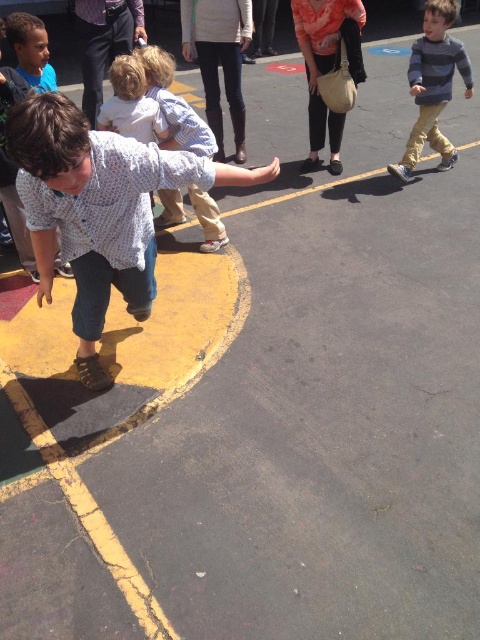
Which is more to the left, denim jeans at left or dark gray pants at upper center?

dark gray pants at upper center

The height and width of the screenshot is (640, 480). What are the coordinates of `denim jeans at left` in the screenshot? It's located at (98, 211).

You are a GUI agent. You are given a task and a screenshot of the screen. Output one action in this format:
    pyautogui.click(x=<x>, y=<y>)
    Task: Click on the denim jeans at left
    The height and width of the screenshot is (640, 480).
    Given the screenshot: What is the action you would take?
    pyautogui.click(x=98, y=211)

Between denim jeans at left and light blue shirt at center, which one is positioned higher?

light blue shirt at center

Find the location of a particular element. This screenshot has width=480, height=640. denim jeans at left is located at coordinates (98, 211).

Identify the location of denim jeans at left. (98, 211).

Is denim jeans at left wider than striped cotton shirt at upper right?

Yes, denim jeans at left is wider than striped cotton shirt at upper right.

Does denim jeans at left have a greater height compared to striped cotton shirt at upper right?

Incorrect, denim jeans at left's height is not larger of striped cotton shirt at upper right's.

Image resolution: width=480 pixels, height=640 pixels. In order to click on denim jeans at left in this screenshot , I will do `click(98, 211)`.